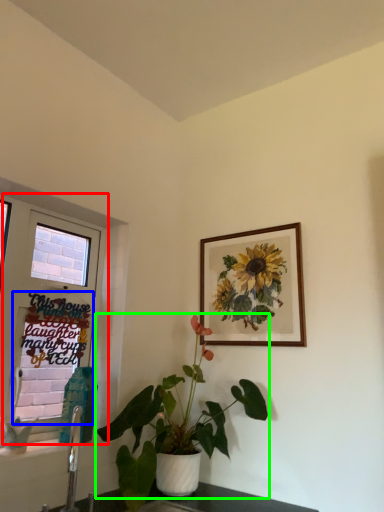
Question: Considering the real-world distances, which object is closest to window (highlighted by a red box)? window screen (highlighted by a blue box) or houseplant (highlighted by a green box).

Choices:
 (A) window screen
 (B) houseplant

Answer: (B)